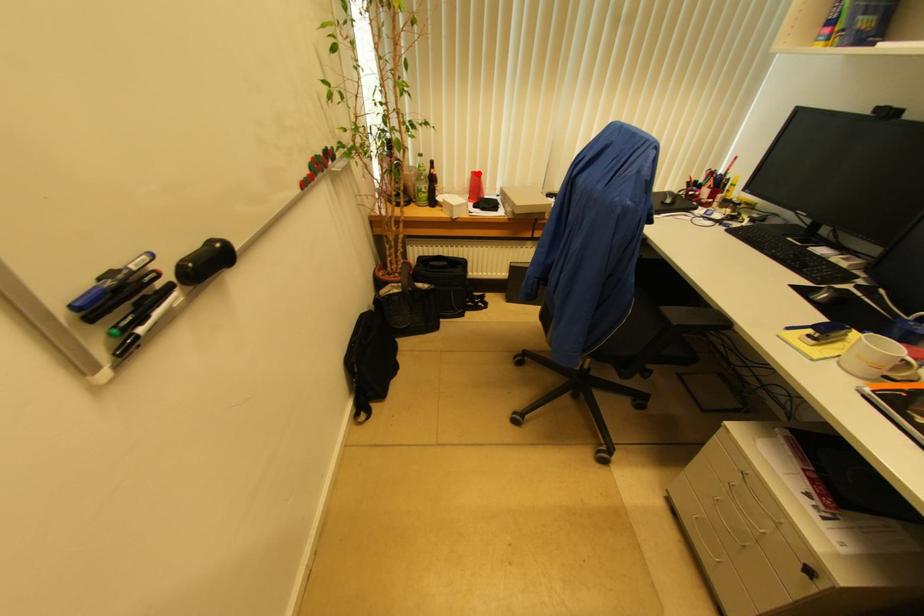
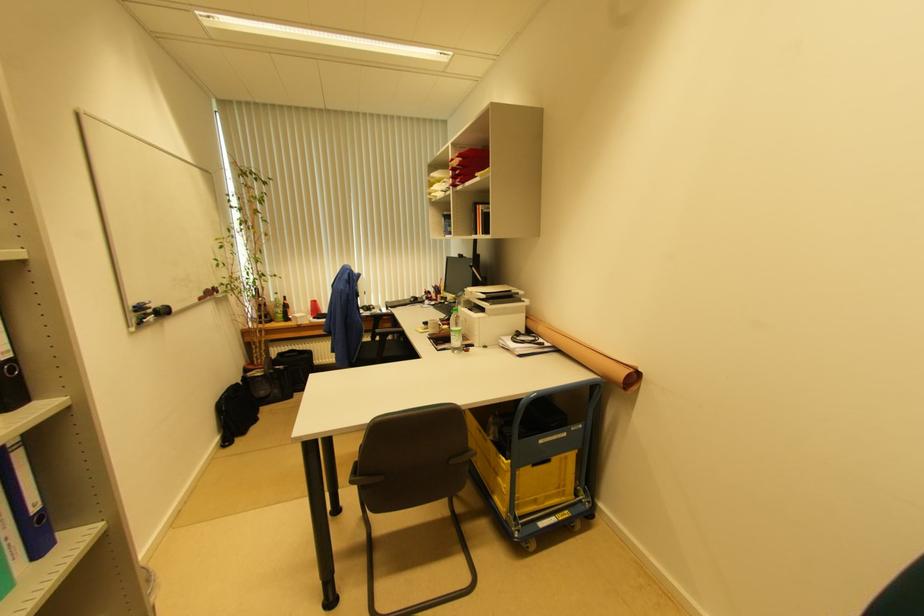
Where in the second image is the point corresponding to the highlighted location from the first image?

(315, 302)